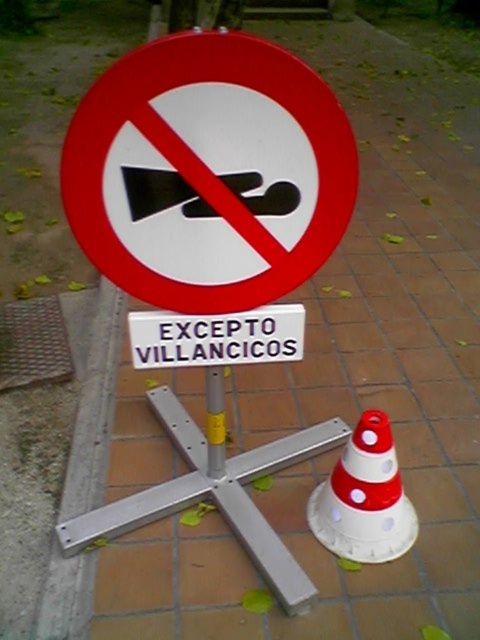
Between point (354, 193) and point (214, 422), which one is positioned in front?

Point (354, 193) is in front.

At what (x,y) coordinates should I click in order to perform the action: click on red plastic sign at center. Please return your answer as a coordinate pair (x, y). The height and width of the screenshot is (640, 480). Looking at the image, I should click on (208, 172).

Between white plastic sign at center and yellow painted metal pole at center, which one is positioned lower?

yellow painted metal pole at center is below.

Is white plastic sign at center bigger than yellow painted metal pole at center?

No.

Who is more distant from viewer, (x=267, y=317) or (x=216, y=388)?

Point (x=216, y=388)

Identify the location of white plastic sign at center. (216, 337).

Can you confirm if red plastic sign at center is thinner than white plastic traffic cone at center?

Incorrect, red plastic sign at center's width is not less than white plastic traffic cone at center's.

Can you confirm if red plastic sign at center is bigger than white plastic traffic cone at center?

Yes.

Does point (119, 61) lie behind point (314, 486)?

Yes, point (119, 61) is behind point (314, 486).

This screenshot has width=480, height=640. Identify the location of red plastic sign at center. (208, 172).